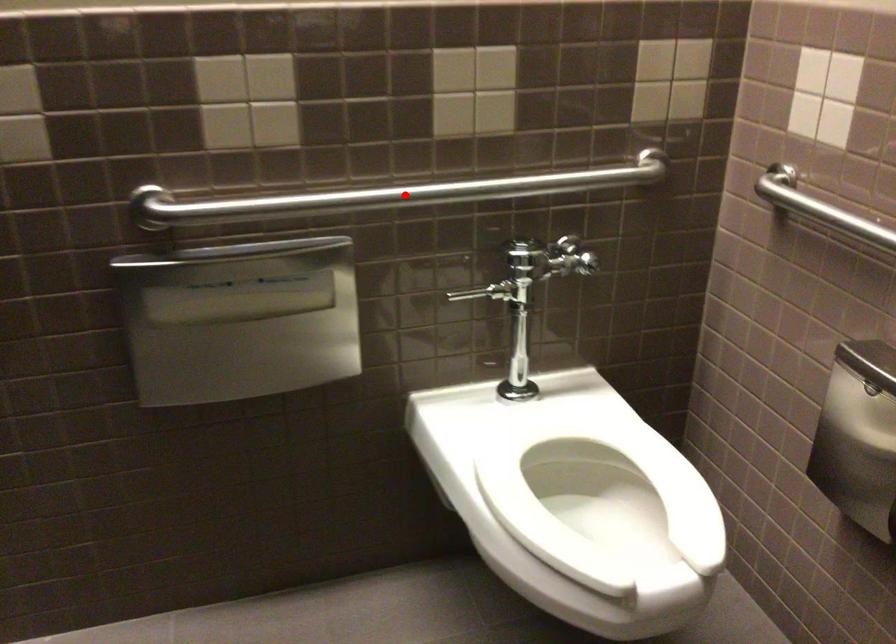
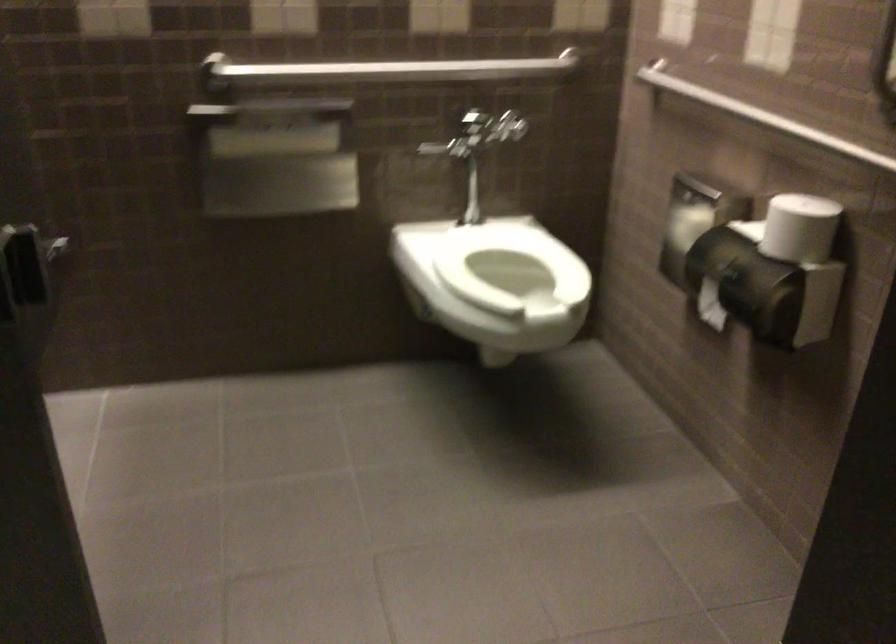
Question: I am providing you with two images of the same scene from different viewpoints. A red point is shown in image1. For the corresponding object point in image2, is it positioned nearer or farther from the camera?

Choices:
 (A) Nearer
 (B) Farther

Answer: (B)